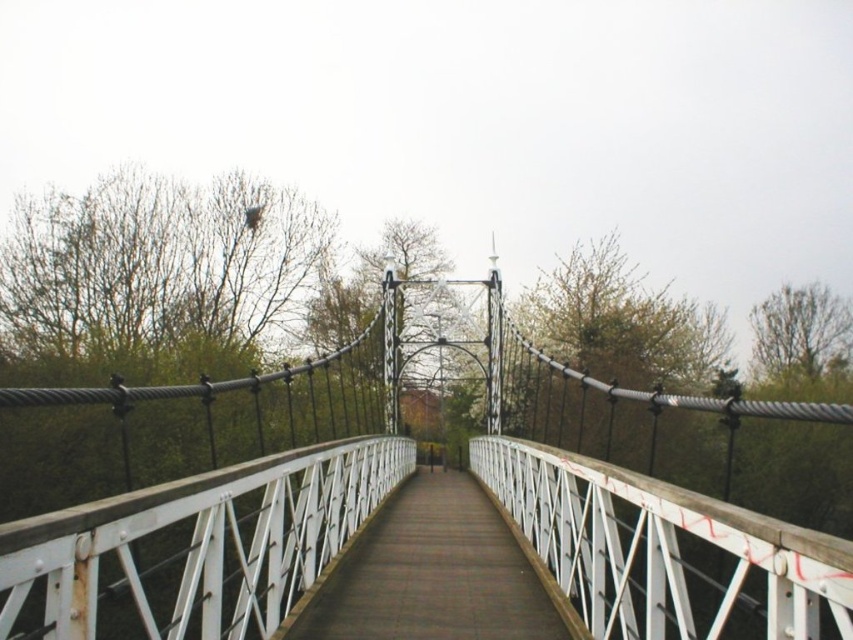
You are standing at the starting point of a path and want to reach the white metal suspension bridge at center. According to the coordinates provided, in which direction should you move relative to your current position?

The white metal suspension bridge at center is located at coordinates point (x=210, y=513). Since coordinates typically represent positions on a grid where higher x values mean right and higher y values mean up, you should move towards the right and slightly upwards to reach it.

You are standing on the wooden walkway of the white metal suspension bridge at center and want to reach the white metal bridge at center. Which bridge do you need to cross to get there?

The white metal suspension bridge at center is taller than the white metal bridge at center, so you need to cross the white metal suspension bridge at center to reach the white metal bridge at center.